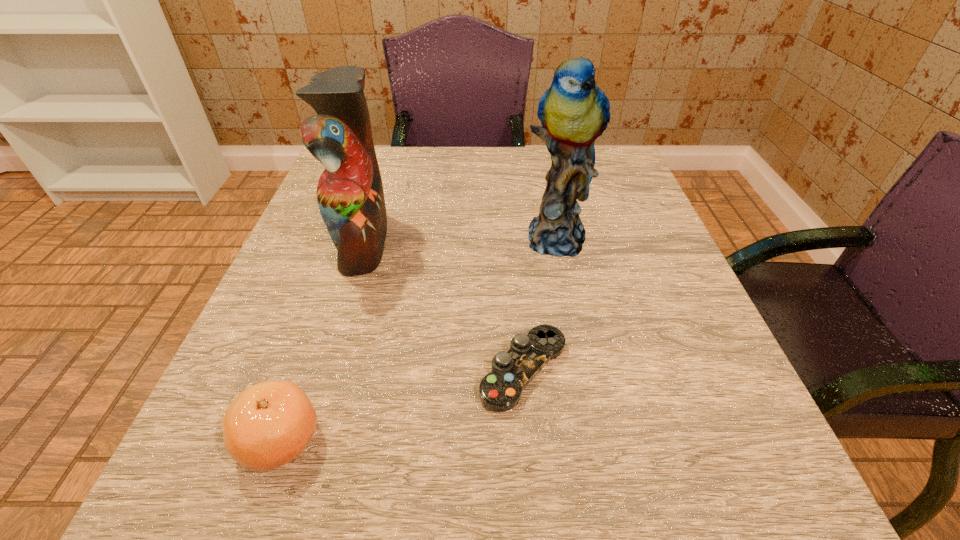
You are a GUI agent. You are given a task and a screenshot of the screen. Output one action in this format:
    pyautogui.click(x=<x>, y=<y>)
    Task: Click on the vacant area in the image that satisfies the following two spatial constraints: 1. on the face of the tallest object; 2. at the face of the left parrot
    The width and height of the screenshot is (960, 540).
    Given the screenshot: What is the action you would take?
    pyautogui.click(x=558, y=241)

The width and height of the screenshot is (960, 540). I want to click on vacant area that satisfies the following two spatial constraints: 1. on the face of the tallest object; 2. at the face of the second tallest object, so pos(558,241).

The image size is (960, 540). I want to click on blank area in the image that satisfies the following two spatial constraints: 1. at the face of the shorter parrot; 2. on the left side of the control, so click(x=324, y=370).

This screenshot has width=960, height=540. Identify the location of vacant space that satisfies the following two spatial constraints: 1. at the face of the third shortest object; 2. on the front side of the clementine. (301, 441).

Find the location of a particular element. vacant space that satisfies the following two spatial constraints: 1. on the back side of the control; 2. on the right side of the clementine is located at coordinates (304, 370).

Where is `free space in the image that satisfies the following two spatial constraints: 1. on the face of the taller parrot; 2. at the face of the left parrot`? free space in the image that satisfies the following two spatial constraints: 1. on the face of the taller parrot; 2. at the face of the left parrot is located at coordinates (558, 241).

The image size is (960, 540). I want to click on vacant space that satisfies the following two spatial constraints: 1. on the back side of the shortest object; 2. at the face of the third shortest object, so click(513, 241).